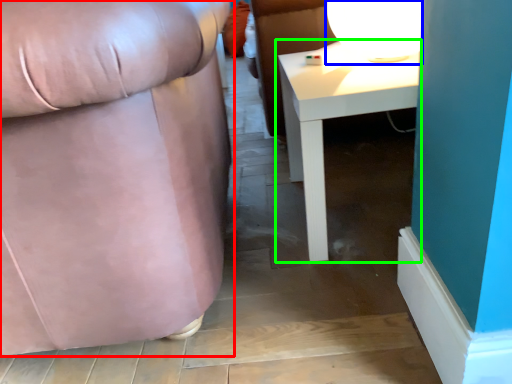
Question: Considering the real-world distances, which object is closest to chair (highlighted by a red box)? table lamp (highlighted by a blue box) or table (highlighted by a green box).

Choices:
 (A) table lamp
 (B) table

Answer: (B)